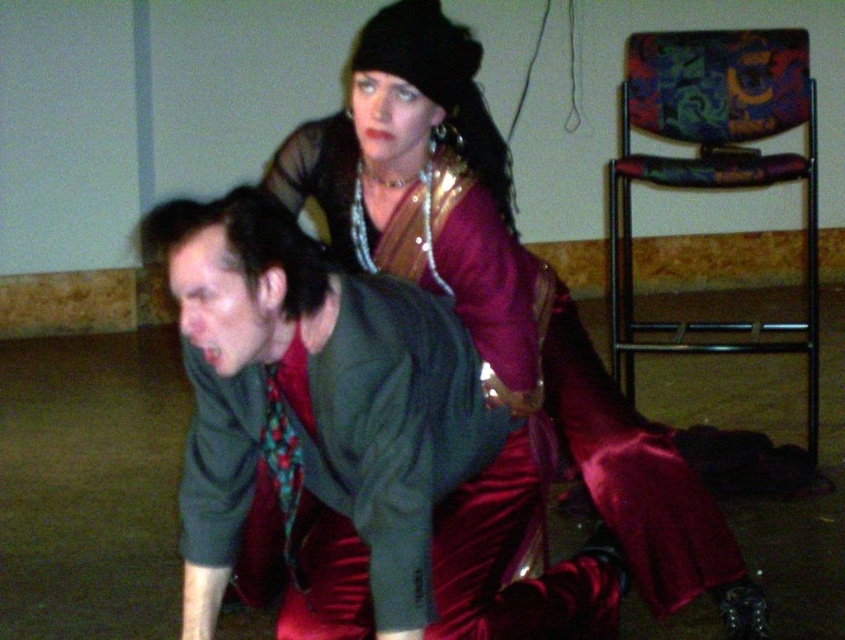
You are a photographer setting up for a photoshoot. You need to position a backdrop that is 2 meters wide. The satin burgundy dress at upper center and the green matte shirt at center are part of the setup. Which object requires a wider space for placement?

The satin burgundy dress at upper center requires a wider space because its width surpasses that of the green matte shirt at center.

You are a photographer setting up a shoot. You need to place a light to the left of the green matte shirt at center. Will the light also be to the left of the satin burgundy dress at upper center?

The satin burgundy dress at upper center is to the right of the green matte shirt at center. Placing the light to the left of the green matte shirt at center would mean the light is also to the left of the satin burgundy dress at upper center since the dress is further to the right.

Based on the photo, you are a photographer trying to capture a clear shot of both the satin burgundy dress at upper center and the green matte shirt at center. Which one should you focus on first to ensure it is in sharp focus?

You should focus on the satin burgundy dress at upper center first because it is closer to you than the green matte shirt at center, so it requires prioritizing in the focus to capture both clearly.